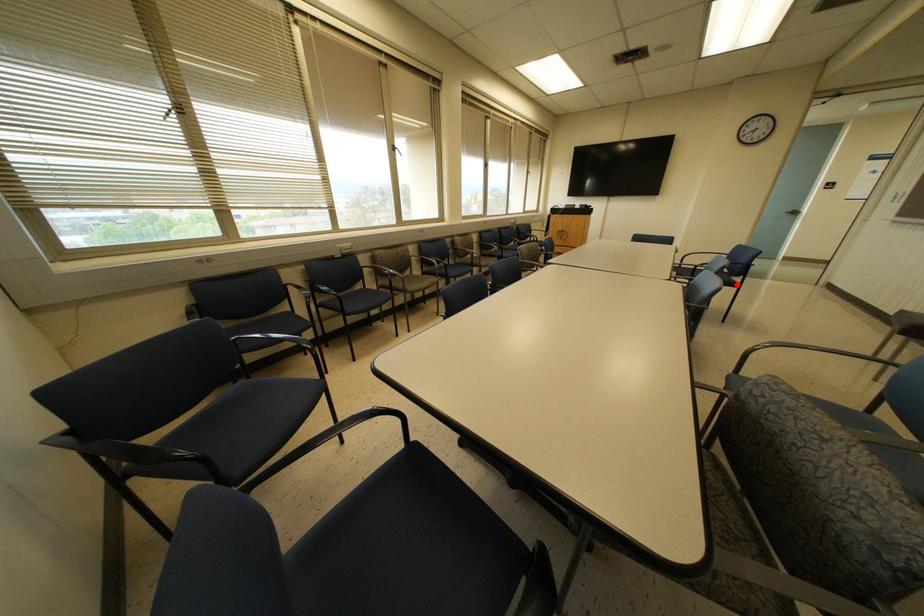
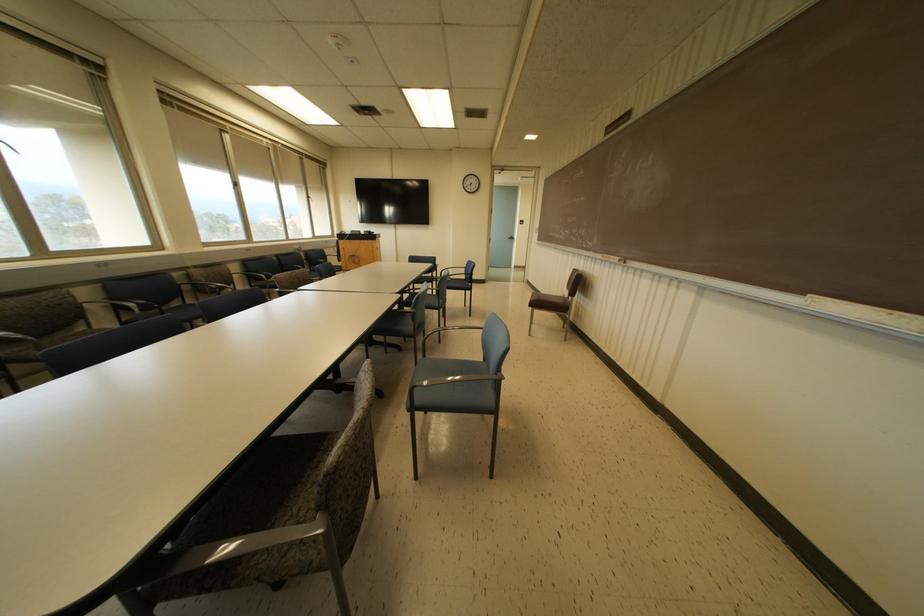
The point at the highlighted location is marked in the first image. Where is the corresponding point in the second image?

(468, 288)